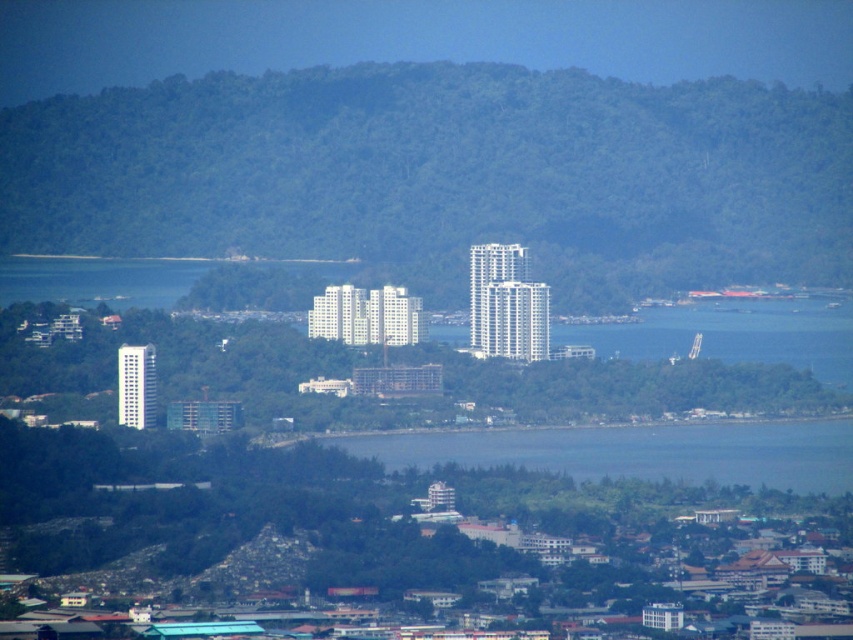
You are standing at the coastal urban area and want to take a photo of the green leafy mountain at center and the blue water at center. Which object will appear larger in the photo?

The green leafy mountain at center will appear larger in the photo because it is closer to the viewer than the blue water at center.

You are a drone operator who needs to fly a drone from your current position to capture aerial footage of the green leafy mountain at center. Given that the drone has a maximum flight range of 2000 feet, will it be able to reach the mountain?

The distance of green leafy mountain at center from camera is 2121.94 feet, which exceeds the drone maximum flight range of 2000 feet. The drone cannot reach the mountain.

You are a city planner analyzing the coastal area. You observe the green leafy mountain at center and the blue water at center. Which of these two features occupies a wider horizontal space in the image?

The green leafy mountain at center has a greater width than the blue water at center, so it occupies a wider horizontal space in the image.